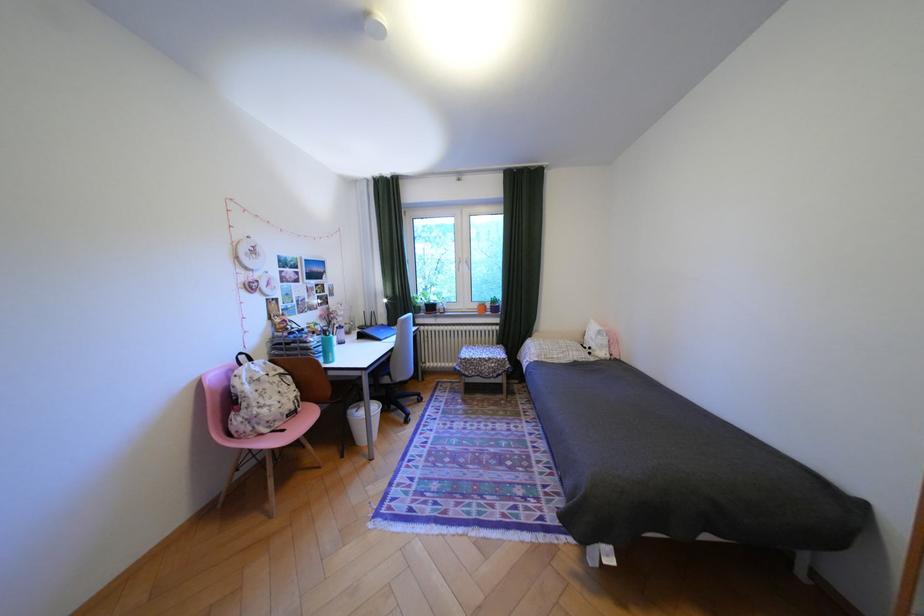
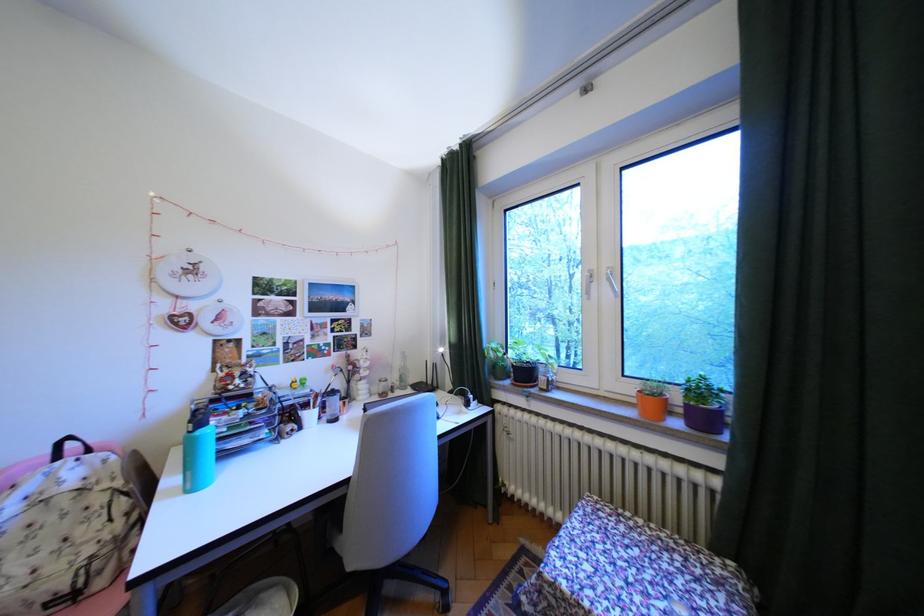
Locate, in the second image, the point that corresponds to (x=403, y=350) in the first image.

(359, 483)